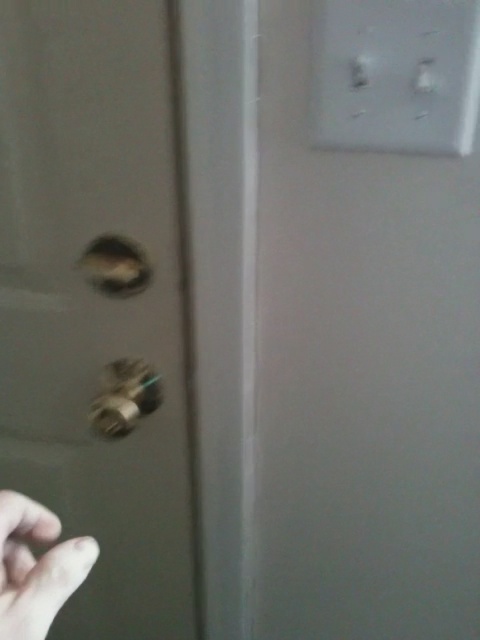
Question: Is matte gold door handle at left smaller than skinny white hand at lower left?

Choices:
 (A) yes
 (B) no

Answer: (B)

Question: Which of these objects is positioned closest to the metallic knob at upper left?

Choices:
 (A) white plastic light switch at upper right
 (B) matte gold door handle at left
 (C) metallic gold door handle at left
 (D) skinny white hand at lower left

Answer: (C)

Question: Which object is positioned closest to the metallic gold door handle at left?

Choices:
 (A) skinny white hand at lower left
 (B) white plastic light switch at upper right
 (C) matte gold door handle at left
 (D) metallic knob at upper left

Answer: (D)

Question: Is matte gold door handle at left above metallic gold door handle at left?

Choices:
 (A) yes
 (B) no

Answer: (B)

Question: Which point is farther to the camera?

Choices:
 (A) (36, 541)
 (B) (84, 58)
 (C) (399, 61)
 (D) (103, 403)

Answer: (D)

Question: Can you confirm if white plastic light switch at upper right is positioned to the right of skinny white hand at lower left?

Choices:
 (A) no
 (B) yes

Answer: (B)